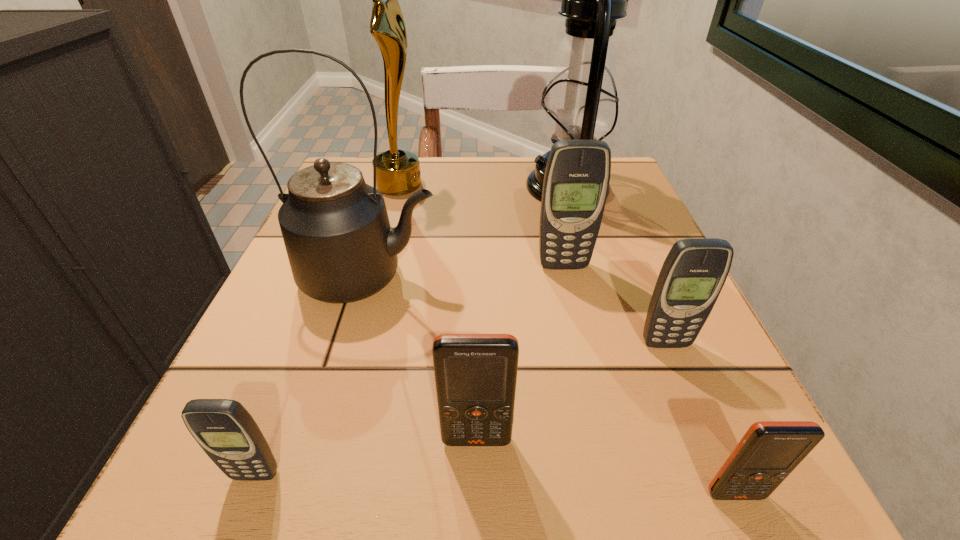
The width and height of the screenshot is (960, 540). I want to click on black oil lamp, so tap(580, 102).

The image size is (960, 540). What are the coordinates of `award` in the screenshot? It's located at (398, 172).

The width and height of the screenshot is (960, 540). What are the coordinates of `the third tallest object` in the screenshot? It's located at (341, 248).

The height and width of the screenshot is (540, 960). I want to click on the third cellular telephone from right to left, so click(576, 181).

At what (x,y) coordinates should I click in order to perform the action: click on the biggest gray cellular telephone. Please return your answer as a coordinate pair (x, y). Image resolution: width=960 pixels, height=540 pixels. Looking at the image, I should click on (576, 181).

Identify the location of the second nearest gray cellular telephone. (694, 272).

At what (x,y) coordinates should I click in order to perform the action: click on the second farthest cellular telephone. Please return your answer as a coordinate pair (x, y). The image size is (960, 540). Looking at the image, I should click on (694, 272).

Locate an element on the screen. the third nearest cellular telephone is located at coordinates (475, 374).

The width and height of the screenshot is (960, 540). Identify the location of the farther orange cellular telephone. (475, 374).

Where is `the nearest cellular telephone`? This screenshot has height=540, width=960. the nearest cellular telephone is located at coordinates (769, 451).